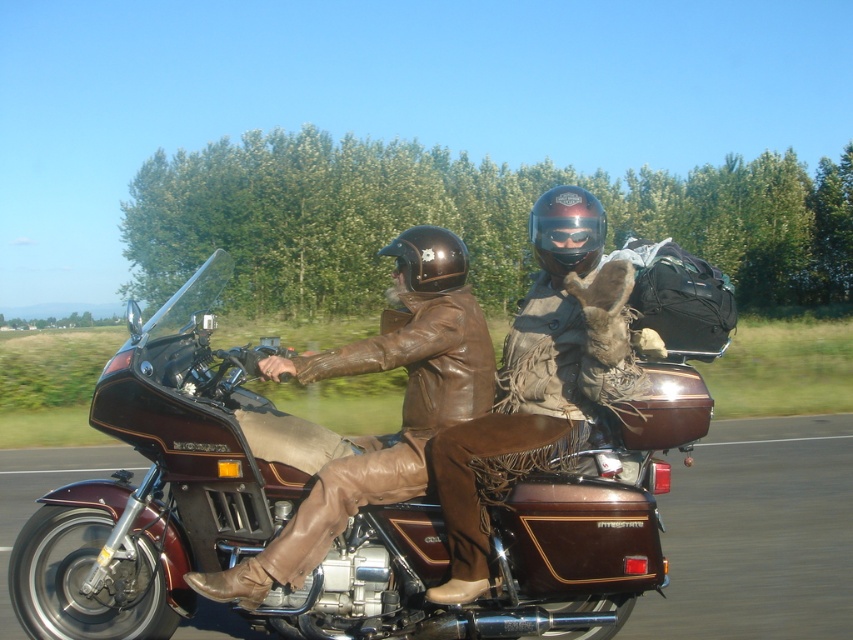
You are a delivery person who needs to place a package on the brown leather motorcycle at center. You are currently holding the package and standing next to the leather jacket at center. Can you reach the motorcycle from your current position without moving your feet?

The brown leather motorcycle at center and leather jacket at center are 1.21 meters apart. Since the average human arm reach is about 1 meter, you cannot reach the motorcycle from your current position without moving your feet.